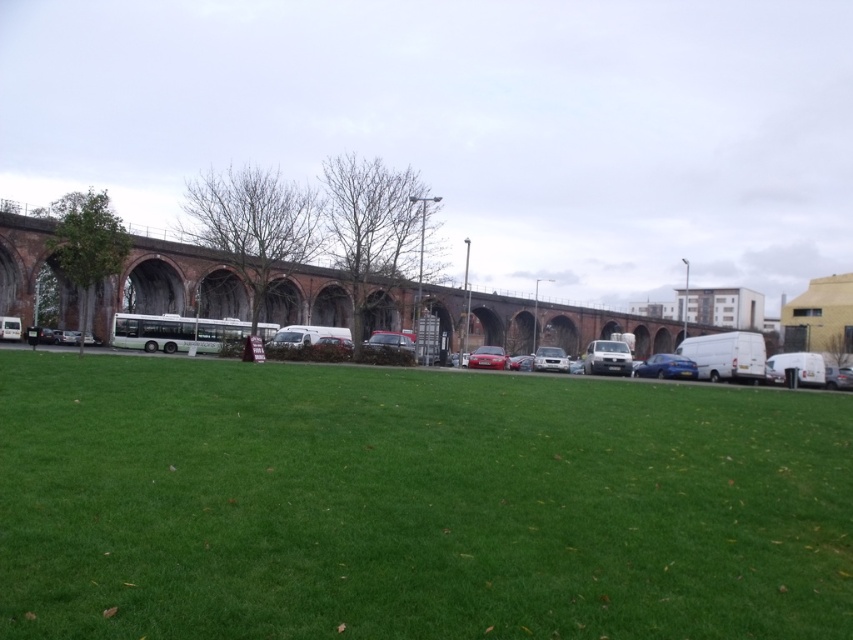
How far apart are green grass at lower center and white glossy van at center?

green grass at lower center and white glossy van at center are 29.82 meters apart from each other.

Is point (21, 358) less distant than point (543, 356)?

Yes, it is in front of point (543, 356).

This screenshot has height=640, width=853. What are the coordinates of `green grass at lower center` in the screenshot? It's located at (415, 504).

Is white matte van at center smaller than white glossy van at center?

Actually, white matte van at center might be larger than white glossy van at center.

At what (x,y) coordinates should I click in order to perform the action: click on white matte van at center. Please return your answer as a coordinate pair (x, y). Looking at the image, I should click on (607, 356).

Does green grass at lower center lie behind glossy red car at center?

No, it is not.

Can you confirm if green grass at lower center is smaller than glossy red car at center?

Indeed, green grass at lower center has a smaller size compared to glossy red car at center.

You are a GUI agent. You are given a task and a screenshot of the screen. Output one action in this format:
    pyautogui.click(x=<x>, y=<y>)
    Task: Click on the green grass at lower center
    The height and width of the screenshot is (640, 853).
    Given the screenshot: What is the action you would take?
    pyautogui.click(x=415, y=504)